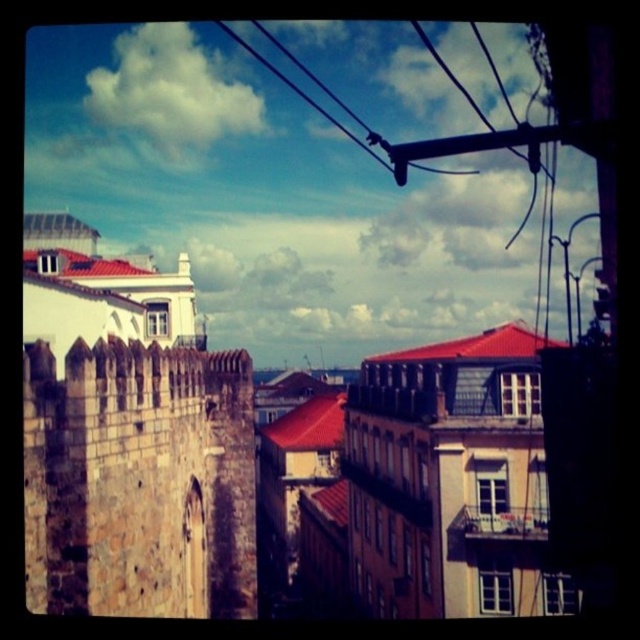
Question: Which point is closer to the camera?

Choices:
 (A) brown stone wall at left
 (B) black wire at upper center

Answer: (A)

Question: In this image, where is brown stone wall at left located relative to black wire at upper center?

Choices:
 (A) left
 (B) right

Answer: (B)

Question: Does brown stone wall at left have a greater width compared to black wire at upper center?

Choices:
 (A) no
 (B) yes

Answer: (A)

Question: Can you confirm if brown stone wall at left is bigger than black wire at upper center?

Choices:
 (A) no
 (B) yes

Answer: (A)